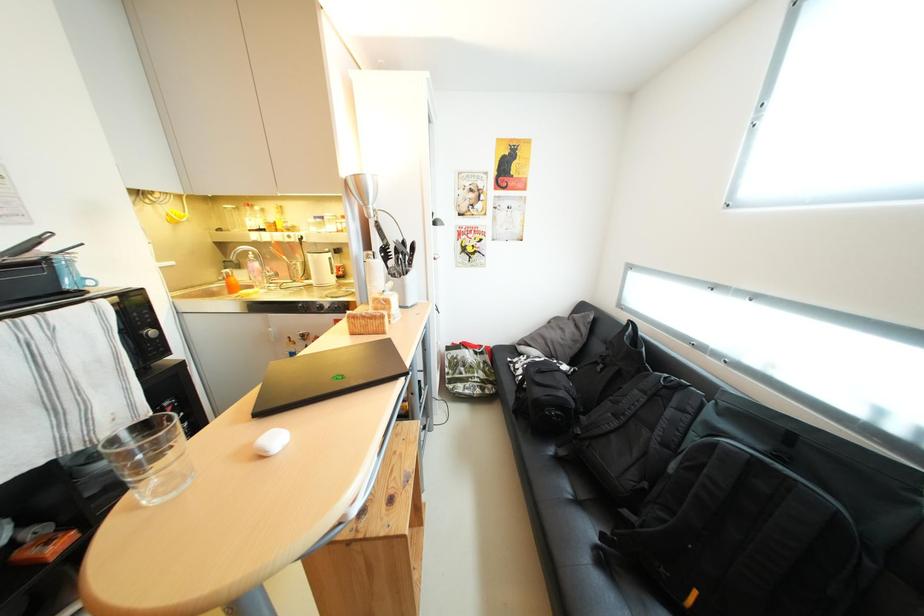
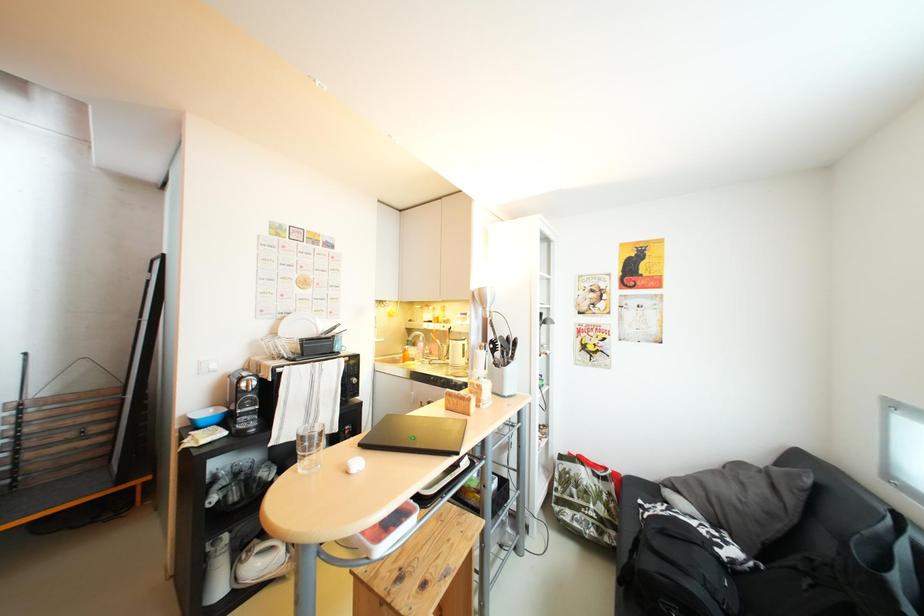
How did the camera likely rotate?

The camera rotated toward left-up.